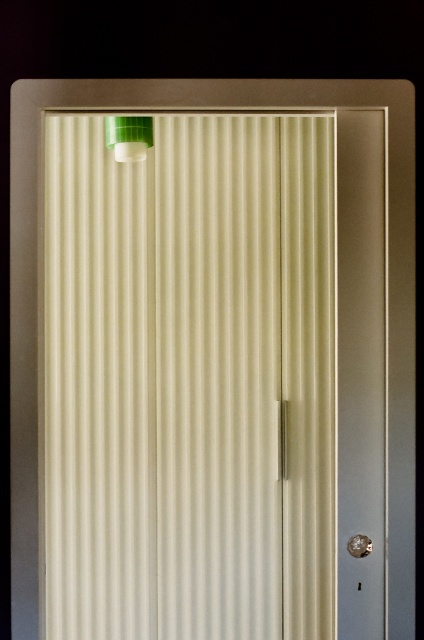
You are standing in front of the door with vertical blinds. There is a point at coordinate (189,378). What is this point located on?

The point at coordinate (189,378) is located on the white ribbed curtain at upper center.

Consider the image. You are trying to determine which object is wider between the white ribbed curtain at upper center and the green plastic cap at upper left. Based on the scene description, which one has a greater width?

The white ribbed curtain at upper center has a greater width than the green plastic cap at upper left according to the description.

You are trying to locate the white ribbed curtain at upper center in the image. What are its coordinates?

The white ribbed curtain at upper center is located at coordinates point (189, 378).